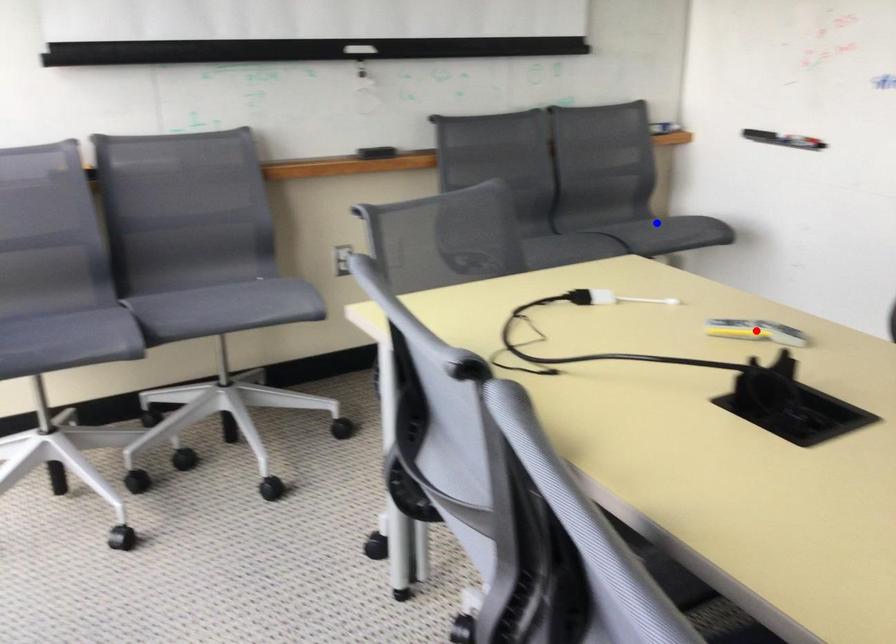
Question: In the image, two points are highlighted. Which point is nearer to the camera? Reply with the corresponding letter.

Choices:
 (A) blue point
 (B) red point

Answer: (B)